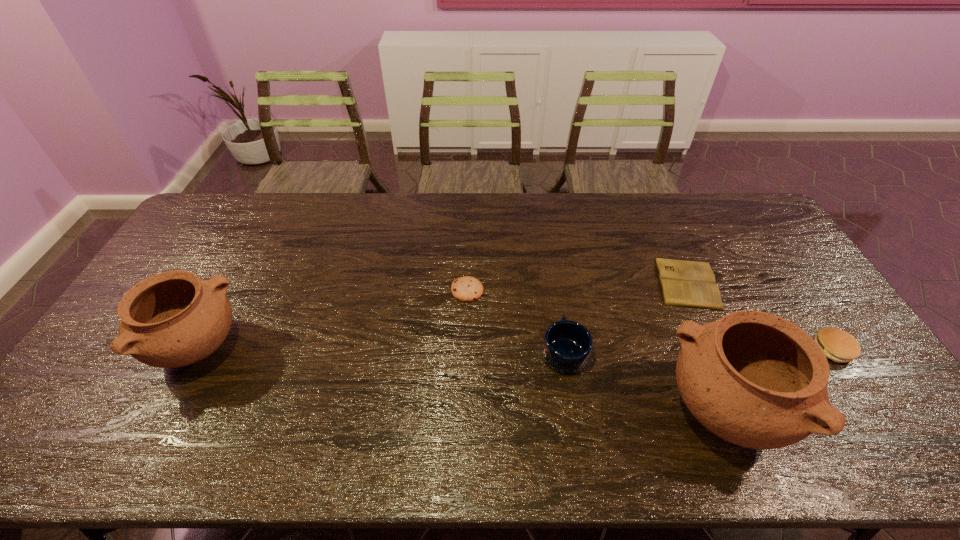
Identify the location of the left pottery. This screenshot has width=960, height=540. (172, 319).

I want to click on the second tallest object, so click(x=172, y=319).

The height and width of the screenshot is (540, 960). I want to click on the right pottery, so click(754, 379).

Where is `the taller pottery`? Image resolution: width=960 pixels, height=540 pixels. the taller pottery is located at coordinates (754, 379).

Find the location of `book`. book is located at coordinates (691, 284).

Locate an element on the screen. the rightmost object is located at coordinates (838, 345).

You are a GUI agent. You are given a task and a screenshot of the screen. Output one action in this format:
    pyautogui.click(x=<x>, y=<y>)
    Task: Click on the patty
    The width and height of the screenshot is (960, 540).
    Given the screenshot: What is the action you would take?
    pyautogui.click(x=838, y=345)

The width and height of the screenshot is (960, 540). I want to click on the fifth tallest object, so click(x=467, y=288).

This screenshot has height=540, width=960. What are the coordinates of `cookie` in the screenshot? It's located at (467, 288).

You are a GUI agent. You are given a task and a screenshot of the screen. Output one action in this format:
    pyautogui.click(x=<x>, y=<y>)
    Task: Click on the mug
    This screenshot has height=540, width=960.
    Given the screenshot: What is the action you would take?
    pyautogui.click(x=567, y=345)